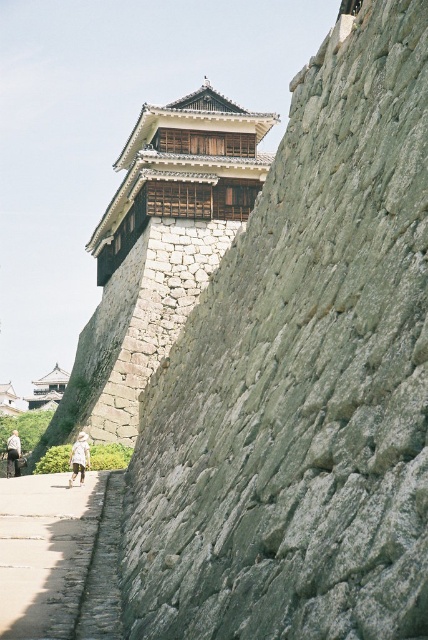
Who is positioned more to the right, gray rough stone wall at upper left or white cotton shirt at lower left?

gray rough stone wall at upper left

Which is in front, point (357, 173) or point (6, 448)?

Point (357, 173) is more forward.

Locate an element on the screen. This screenshot has width=428, height=640. gray rough stone wall at upper left is located at coordinates (303, 378).

Can you confirm if light beige cotton shirt at center is wider than white cotton shirt at lower left?

In fact, light beige cotton shirt at center might be narrower than white cotton shirt at lower left.

Who is higher up, light beige cotton shirt at center or white cotton shirt at lower left?

light beige cotton shirt at center is above.

Between point (83, 433) and point (15, 440), which one is positioned in front?

Positioned in front is point (83, 433).

You are a GUI agent. You are given a task and a screenshot of the screen. Output one action in this format:
    pyautogui.click(x=<x>, y=<y>)
    Task: Click on the light beige cotton shirt at center
    The image size is (428, 640).
    Given the screenshot: What is the action you would take?
    pyautogui.click(x=79, y=458)

Does point (17, 556) lie behind point (83, 444)?

No, it is in front of (83, 444).

Which is more to the right, smooth concrete path at center or light beige cotton shirt at center?

smooth concrete path at center is more to the right.

Who is more distant from viewer, (5,618) or (80,460)?

The point (80,460) is behind.

This screenshot has width=428, height=640. What are the coordinates of `smooth concrete path at center` in the screenshot? It's located at (45, 552).